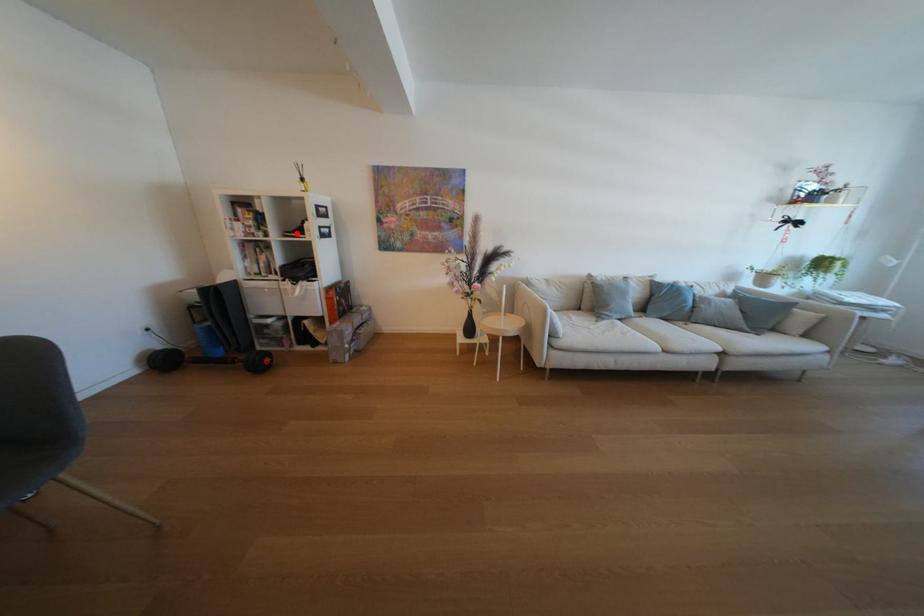
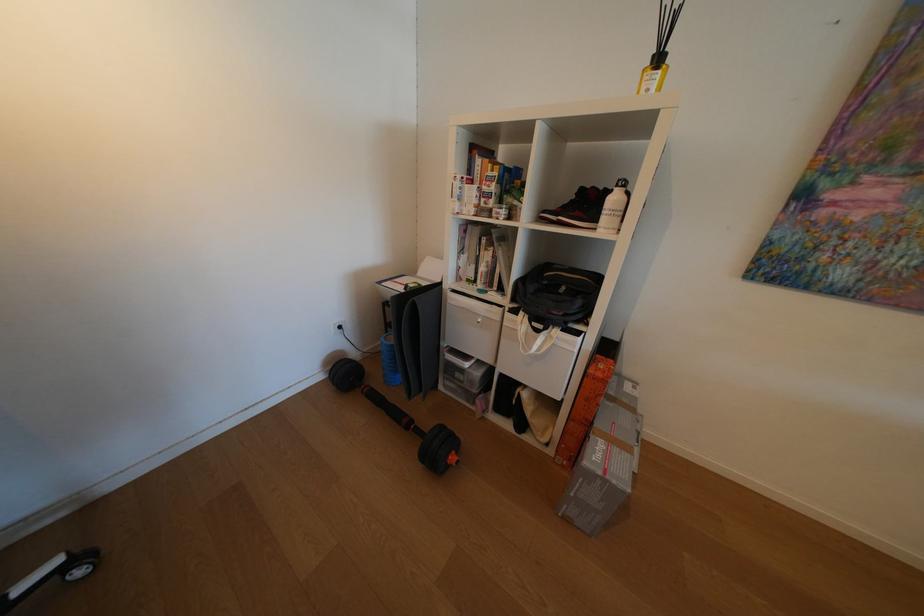
Find the pixel in the second image that matches the highlighted location in the first image.

(554, 213)